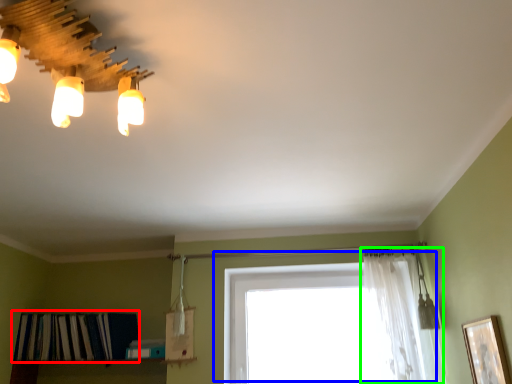
Question: Estimate the real-world distances between objects in this image. Which object is farther from shelf (highlighted by a red box), window (highlighted by a blue box) or curtain (highlighted by a green box)?

Choices:
 (A) window
 (B) curtain

Answer: (B)